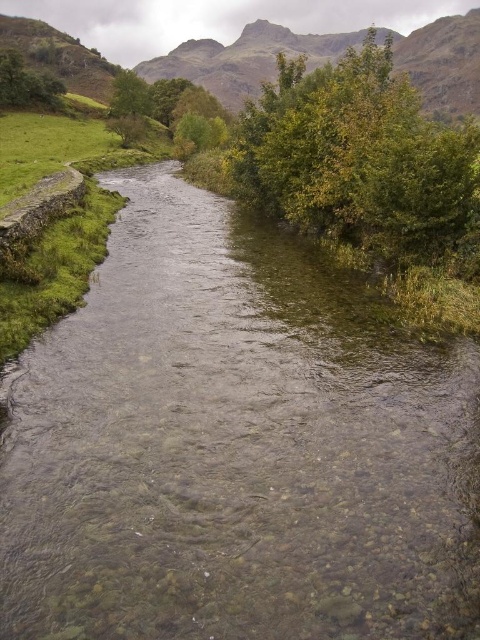
Question: Which point is closer to the camera taking this photo?

Choices:
 (A) (172, 56)
 (B) (328, 99)
 (C) (8, 99)

Answer: (B)

Question: From the image, what is the correct spatial relationship of green leafy tree at upper center in relation to green leafy tree at upper left?

Choices:
 (A) left
 (B) right

Answer: (B)

Question: Which object is positioned farthest from the green leafy tree at upper center?

Choices:
 (A) rugged stone mountain at upper center
 (B) green leafy tree at upper left

Answer: (A)

Question: Can you confirm if green leafy tree at upper center is positioned to the right of green leafy tree at upper left?

Choices:
 (A) no
 (B) yes

Answer: (B)

Question: Where is rugged stone mountain at upper center located in relation to green leafy tree at upper left in the image?

Choices:
 (A) above
 (B) below

Answer: (A)

Question: Which of these objects is positioned farthest from the green leafy tree at upper left?

Choices:
 (A) rugged stone mountain at upper center
 (B) green leafy tree at upper center

Answer: (A)